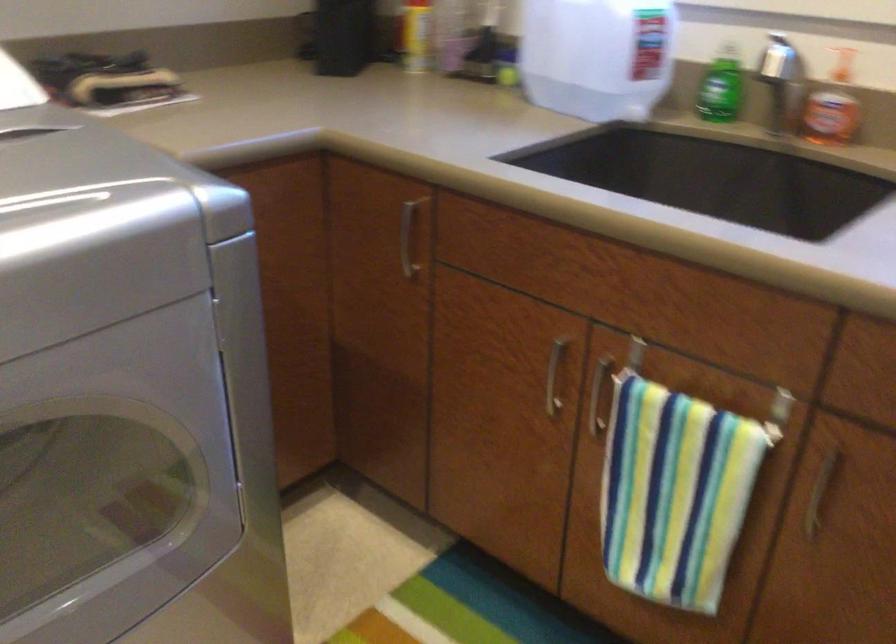
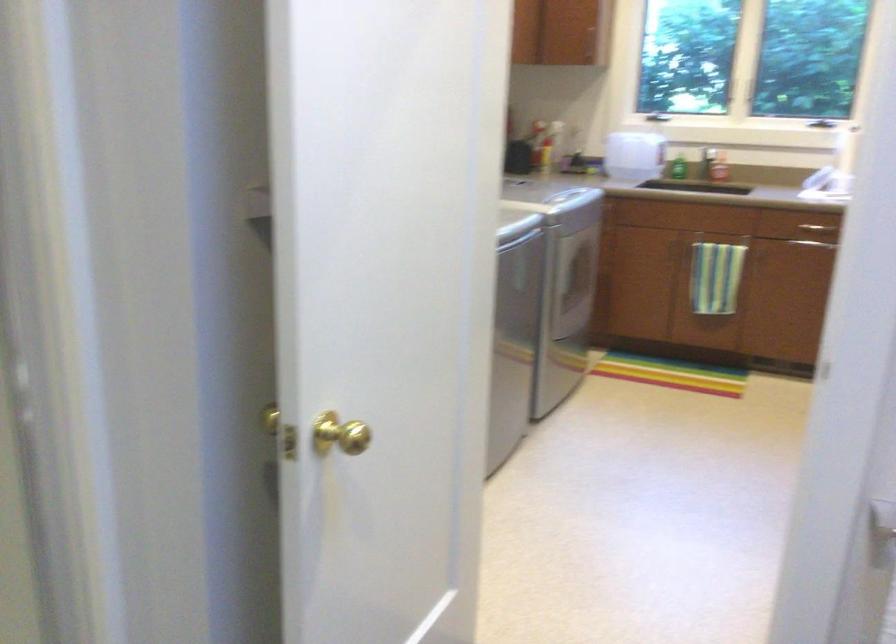
Locate, in the second image, the point that corresponds to (x=695, y=109) in the first image.

(676, 167)